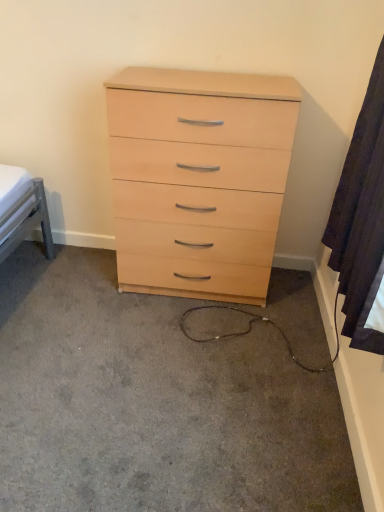
This screenshot has height=512, width=384. What are the coordinates of `vacant region below dark fabric curtain at right (from a real-world perspective)` in the screenshot? It's located at (316, 396).